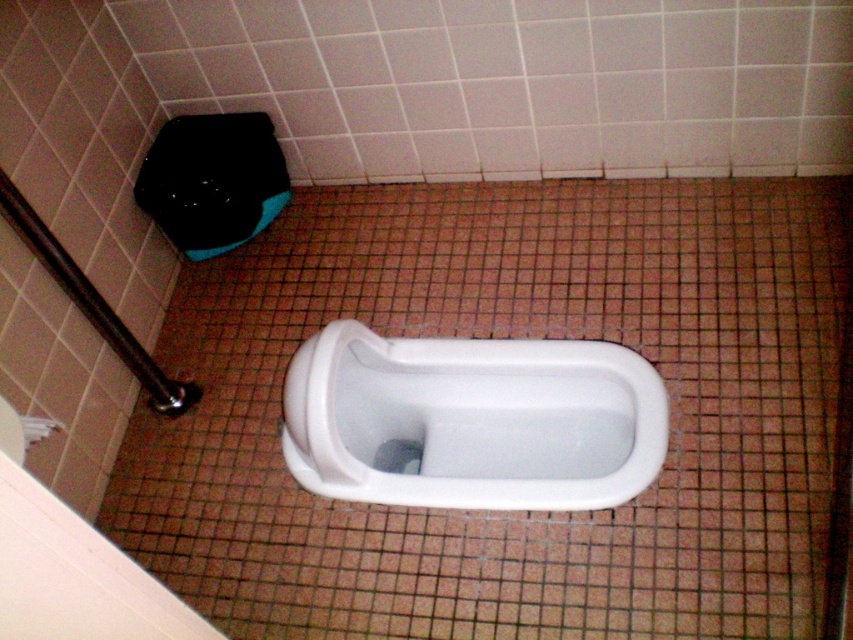
Is point (136, 410) behind point (421, 392)?

No, (136, 410) is in front of (421, 392).

Does white glossy tile at center lie in front of white glossy urinal at center?

Yes, white glossy tile at center is closer to the viewer.

What do you see at coordinates (509, 337) in the screenshot?
I see `white glossy tile at center` at bounding box center [509, 337].

You are a GUI agent. You are given a task and a screenshot of the screen. Output one action in this format:
    pyautogui.click(x=<x>, y=<y>)
    Task: Click on the white glossy tile at center
    The image size is (853, 640).
    Given the screenshot: What is the action you would take?
    pyautogui.click(x=509, y=337)

Can you confirm if white glossy tile at center is positioned above white paper at lower left?

Yes, white glossy tile at center is above white paper at lower left.

The image size is (853, 640). I want to click on white glossy tile at center, so click(x=509, y=337).

In order to click on white glossy tile at center in this screenshot , I will do `click(509, 337)`.

Does point (489, 458) come farther from viewer compared to point (44, 436)?

Yes, it is behind point (44, 436).

In the scene shown: Which is above, white glossy urinal at center or white paper at lower left?

white paper at lower left is higher up.

The image size is (853, 640). I want to click on white glossy urinal at center, so click(473, 420).